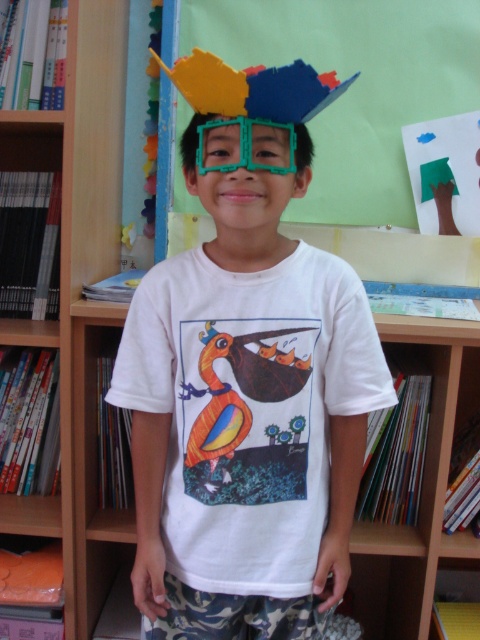
Consider the image. Does matte cardboard bulletin board at upper center appear on the left side of wooden bookshelf at left?

No, matte cardboard bulletin board at upper center is not to the left of wooden bookshelf at left.

Is matte cardboard bulletin board at upper center wider than wooden bookshelf at left?

Indeed, matte cardboard bulletin board at upper center has a greater width compared to wooden bookshelf at left.

Between point (186, 8) and point (108, 13), which one is positioned behind?

The point (186, 8) is more distant.

The image size is (480, 640). I want to click on matte cardboard bulletin board at upper center, so click(362, 112).

Based on the photo, who is positioned more to the right, matte plastic mask at center or matte cardboard bulletin board at upper center?

Positioned to the right is matte cardboard bulletin board at upper center.

Does matte plastic mask at center appear under matte cardboard bulletin board at upper center?

Indeed, matte plastic mask at center is positioned under matte cardboard bulletin board at upper center.

The width and height of the screenshot is (480, 640). Find the location of `matte plastic mask at center`. matte plastic mask at center is located at coordinates point(247,378).

Is matte cardboard bulletin board at upper center behind green plastic glasses at center?

That is True.

Find the location of a particular element. The image size is (480, 640). matte cardboard bulletin board at upper center is located at coordinates (362, 112).